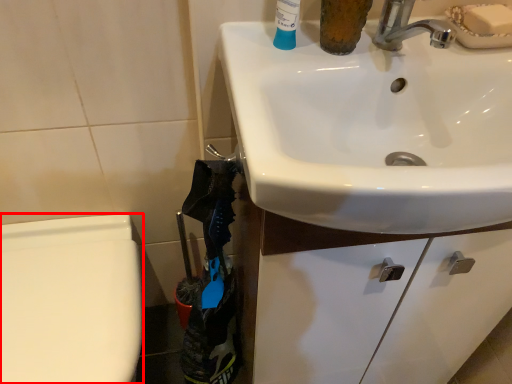
Question: Where is bidet (annotated by the red box) located in relation to sink in the image?

Choices:
 (A) left
 (B) right

Answer: (A)